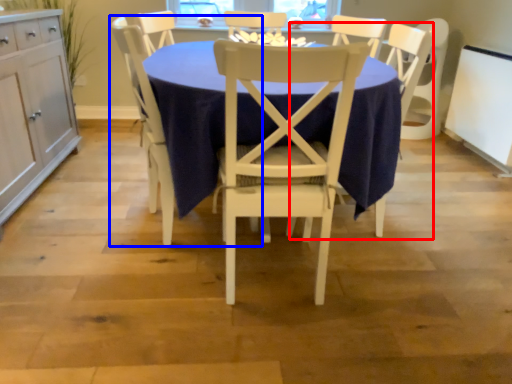
Question: Which object appears farthest to the camera in this image, armchair (highlighted by a red box) or chair (highlighted by a blue box)?

Choices:
 (A) armchair
 (B) chair

Answer: (A)